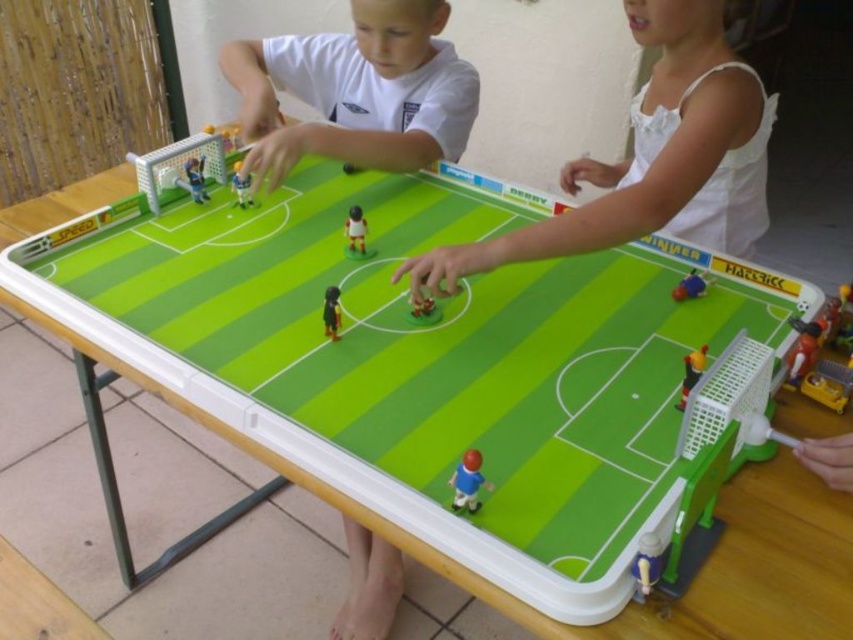
Question: Is shiny metallic figure at center wider than smooth plastic toy at lower right?

Choices:
 (A) no
 (B) yes

Answer: (B)

Question: Is smooth plastic toy at lower right thinner than shiny plastic soccer player at center?

Choices:
 (A) no
 (B) yes

Answer: (B)

Question: Which object appears closest to the camera in this image?

Choices:
 (A) white matte shirt at center
 (B) white plastic figure at center

Answer: (B)

Question: Which object is farther from the camera taking this photo?

Choices:
 (A) matte plastic figure at center
 (B) black plastic figure at center

Answer: (A)

Question: Does smooth plastic toy at lower right have a lesser width compared to black plastic figure at center?

Choices:
 (A) no
 (B) yes

Answer: (B)

Question: Among these objects, which one is farthest from the camera?

Choices:
 (A) shiny plastic soccer ball at center
 (B) black plastic figure at center

Answer: (A)